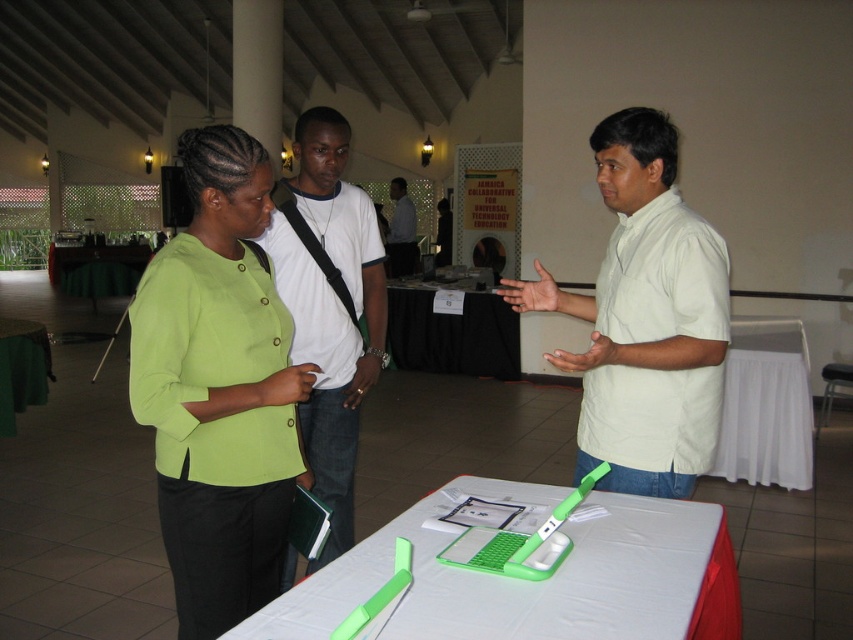
Question: Which of the following is the farthest from the observer?

Choices:
 (A) black fabric table at center
 (B) green plastic table at center

Answer: (A)

Question: Which point is farther to the camera?

Choices:
 (A) black fabric table at center
 (B) light blue shirt at center
 (C) green fabric table at lower left

Answer: (B)

Question: From the image, what is the correct spatial relationship of white cotton t-shirt at center in relation to green fabric table at lower left?

Choices:
 (A) right
 (B) left

Answer: (A)

Question: Is lime green fabric shirt at center smaller than green plastic table at center?

Choices:
 (A) yes
 (B) no

Answer: (B)

Question: Among these objects, which one is nearest to the camera?

Choices:
 (A) white matte shirt at center
 (B) black fabric table at center
 (C) green plastic table at center

Answer: (C)

Question: Does green plastic table at center lie behind white cloth table at right?

Choices:
 (A) yes
 (B) no

Answer: (B)